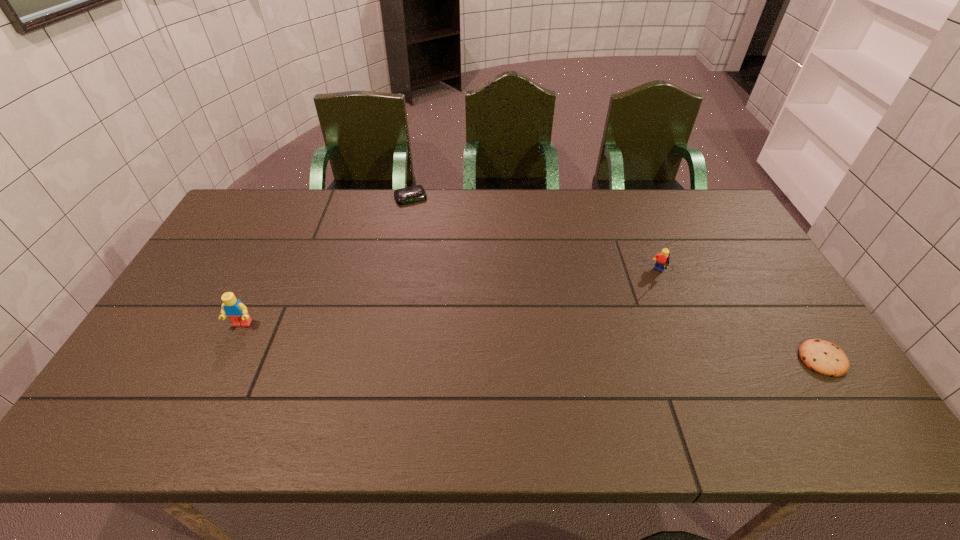
The image size is (960, 540). In the image, there is a desktop. Find the location of `blank space at the far edge`. blank space at the far edge is located at coordinates (437, 193).

In the image, there is a desktop. Where is `free region at the near edge`? Image resolution: width=960 pixels, height=540 pixels. free region at the near edge is located at coordinates (662, 366).

In the image, there is a desktop. At what (x,y) coordinates should I click in order to perform the action: click on vacant space at the left edge. Please return your answer as a coordinate pair (x, y). Looking at the image, I should click on (224, 273).

This screenshot has height=540, width=960. In order to click on blank space at the right edge in this screenshot , I will do click(748, 275).

At what (x,y) coordinates should I click in order to perform the action: click on free location at the far left corner. Please return your answer as a coordinate pair (x, y). This screenshot has width=960, height=540. Looking at the image, I should click on (226, 224).

Identify the location of free space at the far right corner. pyautogui.click(x=684, y=197).

I want to click on free space at the near right corner of the desktop, so click(772, 366).

The image size is (960, 540). I want to click on vacant region between the right Lego and the alarm clock, so click(535, 236).

Where is `free space between the farther Lego and the alarm clock`? Image resolution: width=960 pixels, height=540 pixels. free space between the farther Lego and the alarm clock is located at coordinates (535, 236).

Find the location of a particular element. This screenshot has height=540, width=960. free space between the farthest object and the nearest object is located at coordinates (616, 279).